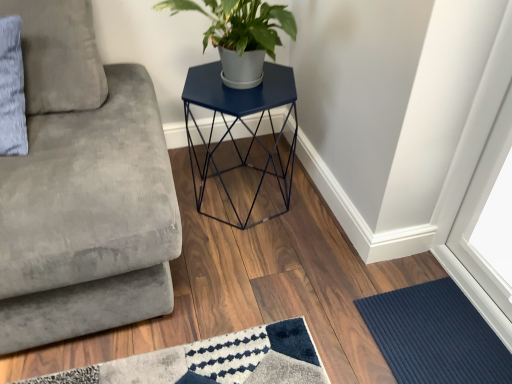
Question: Can you confirm if navy blue ribbed mat at lower right is wider than matte blue hexagonal table at center?

Choices:
 (A) yes
 (B) no

Answer: (B)

Question: From the image's perspective, would you say navy blue ribbed mat at lower right is shown under matte blue hexagonal table at center?

Choices:
 (A) no
 (B) yes

Answer: (B)

Question: Can you confirm if navy blue ribbed mat at lower right is taller than matte blue hexagonal table at center?

Choices:
 (A) yes
 (B) no

Answer: (B)

Question: Is navy blue ribbed mat at lower right smaller than matte blue hexagonal table at center?

Choices:
 (A) yes
 (B) no

Answer: (A)

Question: Is matte blue hexagonal table at center a part of navy blue ribbed mat at lower right?

Choices:
 (A) yes
 (B) no

Answer: (B)

Question: Considering the positions of navy blue ribbed mat at lower right and gray fabric pillow at upper left in the image, is navy blue ribbed mat at lower right taller or shorter than gray fabric pillow at upper left?

Choices:
 (A) short
 (B) tall

Answer: (A)

Question: Is navy blue ribbed mat at lower right inside the boundaries of gray fabric pillow at upper left, or outside?

Choices:
 (A) outside
 (B) inside

Answer: (A)

Question: Is point (467, 377) positioned closer to the camera than point (74, 100)?

Choices:
 (A) closer
 (B) farther

Answer: (A)

Question: From a real-world perspective, is navy blue ribbed mat at lower right above or below gray fabric pillow at upper left?

Choices:
 (A) below
 (B) above

Answer: (A)

Question: Is point (198, 210) positioned closer to the camera than point (73, 215)?

Choices:
 (A) farther
 (B) closer

Answer: (A)

Question: Is matte blue hexagonal table at center wider or thinner than velvet gray studio couch at left?

Choices:
 (A) wide
 (B) thin

Answer: (B)

Question: Is matte blue hexagonal table at center bigger or smaller than velvet gray studio couch at left?

Choices:
 (A) small
 (B) big

Answer: (A)

Question: Considering their positions, is matte blue hexagonal table at center located in front of or behind velvet gray studio couch at left?

Choices:
 (A) front
 (B) behind

Answer: (B)

Question: From the image's perspective, is gray fabric pillow at upper left positioned above or below matte blue hexagonal table at center?

Choices:
 (A) below
 (B) above

Answer: (B)

Question: Based on their sizes in the image, would you say gray fabric pillow at upper left is bigger or smaller than matte blue hexagonal table at center?

Choices:
 (A) small
 (B) big

Answer: (A)